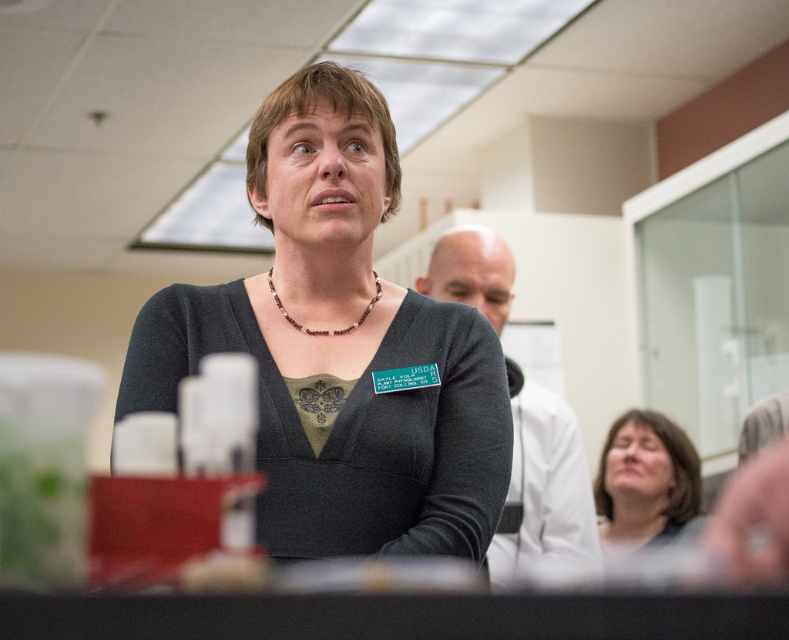
Question: Considering the relative positions of matte black sweater at center and matte gray sweater at lower right in the image provided, where is matte black sweater at center located with respect to matte gray sweater at lower right?

Choices:
 (A) right
 (B) left

Answer: (B)

Question: Is matte gray sweater at lower right above multicolored beaded necklace at center?

Choices:
 (A) no
 (B) yes

Answer: (A)

Question: Which is farther from the multicolored beaded necklace at center?

Choices:
 (A) matte black sweater at center
 (B) matte gray sweater at lower right

Answer: (B)

Question: Which point is farther to the camera?

Choices:
 (A) (664, 484)
 (B) (372, 273)

Answer: (A)

Question: Observing the image, what is the correct spatial positioning of matte black sweater at center in reference to multicolored beaded necklace at center?

Choices:
 (A) below
 (B) above

Answer: (A)

Question: Which point is closer to the camera taking this photo?

Choices:
 (A) (627, 525)
 (B) (363, 266)
 (C) (376, 300)

Answer: (C)